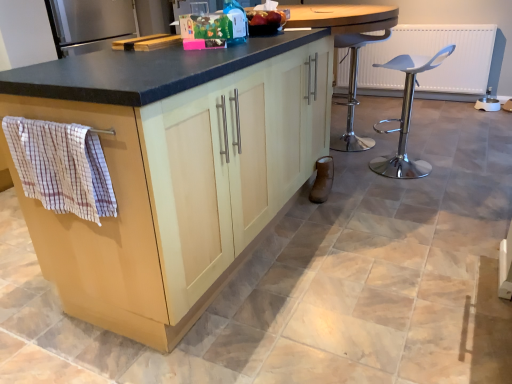
Question: Is matte wood cabinet at left oriented away from white plastic stool at right?

Choices:
 (A) no
 (B) yes

Answer: (A)

Question: Is matte wood cabinet at left to the left of white plastic stool at right from the viewer's perspective?

Choices:
 (A) yes
 (B) no

Answer: (A)

Question: Considering the relative sizes of matte wood cabinet at left and white plastic stool at right in the image provided, is matte wood cabinet at left bigger than white plastic stool at right?

Choices:
 (A) no
 (B) yes

Answer: (B)

Question: Could you tell me if matte wood cabinet at left is turned towards white plastic stool at right?

Choices:
 (A) no
 (B) yes

Answer: (A)

Question: Is matte wood cabinet at left wider than white plastic stool at right?

Choices:
 (A) yes
 (B) no

Answer: (A)

Question: Is matte wood cabinet at left smaller than white plastic stool at right?

Choices:
 (A) yes
 (B) no

Answer: (B)

Question: From the image's perspective, is white plastic stool at right located above checkered fabric hand towel at left?

Choices:
 (A) yes
 (B) no

Answer: (A)

Question: Can you confirm if white plastic stool at right is wider than checkered fabric hand towel at left?

Choices:
 (A) yes
 (B) no

Answer: (B)

Question: Is white plastic stool at right beside checkered fabric hand towel at left?

Choices:
 (A) yes
 (B) no

Answer: (B)

Question: Is white plastic stool at right outside of checkered fabric hand towel at left?

Choices:
 (A) no
 (B) yes

Answer: (B)

Question: Considering the relative sizes of white plastic stool at right and checkered fabric hand towel at left in the image provided, is white plastic stool at right shorter than checkered fabric hand towel at left?

Choices:
 (A) yes
 (B) no

Answer: (B)

Question: Is white plastic stool at right closer to the viewer compared to checkered fabric hand towel at left?

Choices:
 (A) yes
 (B) no

Answer: (B)

Question: Considering the relative sizes of white plastic stool at right and matte wood cabinet at left in the image provided, is white plastic stool at right shorter than matte wood cabinet at left?

Choices:
 (A) no
 (B) yes

Answer: (B)